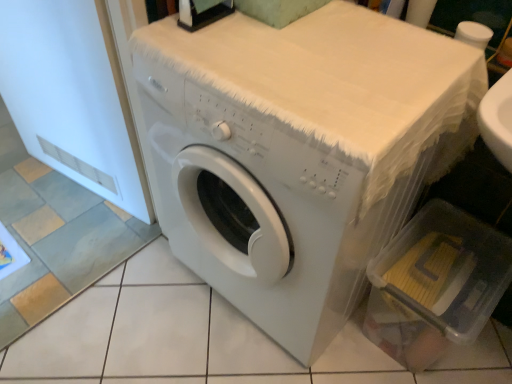
Question: Considering the relative sizes of clear plastic container at lower right and white matte washing machine at center in the image provided, is clear plastic container at lower right shorter than white matte washing machine at center?

Choices:
 (A) yes
 (B) no

Answer: (A)

Question: Is white matte washing machine at center a part of clear plastic container at lower right?

Choices:
 (A) no
 (B) yes

Answer: (A)

Question: From the image's perspective, is clear plastic container at lower right below white matte washing machine at center?

Choices:
 (A) no
 (B) yes

Answer: (B)

Question: Is clear plastic container at lower right looking in the opposite direction of white matte washing machine at center?

Choices:
 (A) no
 (B) yes

Answer: (A)

Question: Is clear plastic container at lower right directly adjacent to white matte washing machine at center?

Choices:
 (A) no
 (B) yes

Answer: (A)

Question: Does point (227, 274) appear closer or farther from the camera than point (34, 39)?

Choices:
 (A) closer
 (B) farther

Answer: (A)

Question: From a real-world perspective, is white matte washing machine at center positioned above or below white matte screen door at left?

Choices:
 (A) below
 (B) above

Answer: (A)

Question: Is white matte washing machine at center wider or thinner than white matte screen door at left?

Choices:
 (A) thin
 (B) wide

Answer: (B)

Question: From the image's perspective, is white matte washing machine at center located above or below white matte screen door at left?

Choices:
 (A) below
 (B) above

Answer: (A)

Question: In terms of width, does clear plastic container at lower right look wider or thinner when compared to white matte screen door at left?

Choices:
 (A) wide
 (B) thin

Answer: (A)

Question: From the image's perspective, is clear plastic container at lower right above or below white matte screen door at left?

Choices:
 (A) below
 (B) above

Answer: (A)

Question: Relative to white matte screen door at left, is clear plastic container at lower right in front or behind?

Choices:
 (A) behind
 (B) front

Answer: (A)

Question: Is clear plastic container at lower right taller or shorter than white matte screen door at left?

Choices:
 (A) short
 (B) tall

Answer: (A)

Question: From a real-world perspective, relative to clear plastic container at lower right, is white matte washing machine at center vertically above or below?

Choices:
 (A) above
 (B) below

Answer: (A)

Question: Relative to clear plastic container at lower right, is white matte washing machine at center in front or behind?

Choices:
 (A) behind
 (B) front

Answer: (B)